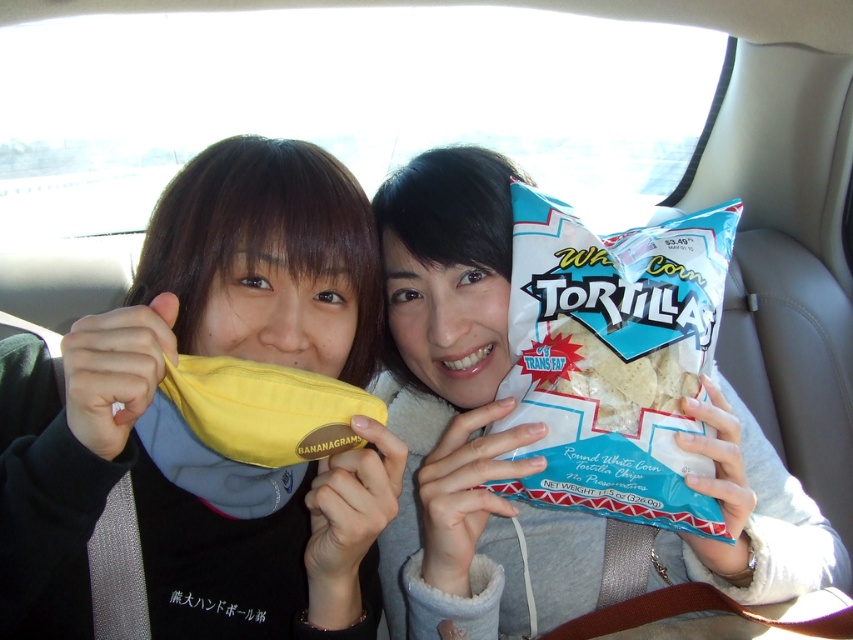
Who is lower down, white paper tortilla chips at center or white corn tortilla at center?

white paper tortilla chips at center

Does white paper tortilla chips at center lie behind white corn tortilla at center?

That is False.

Who is more forward, (405, 408) or (674, 380)?

Point (674, 380)

This screenshot has height=640, width=853. What are the coordinates of `white paper tortilla chips at center` in the screenshot? It's located at (463, 416).

Does point (10, 506) come in front of point (630, 428)?

That is True.

Can you confirm if yellow fabric neck warmer at center is positioned above white corn tortilla at center?

No, yellow fabric neck warmer at center is not above white corn tortilla at center.

Between point (21, 417) and point (585, 381), which one is positioned in front?

Positioned in front is point (585, 381).

Where is `yellow fabric neck warmer at center`? yellow fabric neck warmer at center is located at coordinates (187, 426).

Can you confirm if yellow fabric neck warmer at center is positioned to the left of yellow fabric bag at center?

Indeed, yellow fabric neck warmer at center is positioned on the left side of yellow fabric bag at center.

Who is lower down, yellow fabric neck warmer at center or yellow fabric bag at center?

yellow fabric bag at center is lower down.

Locate an element on the screen. The image size is (853, 640). yellow fabric neck warmer at center is located at coordinates (187, 426).

This screenshot has height=640, width=853. I want to click on yellow fabric neck warmer at center, so click(x=187, y=426).